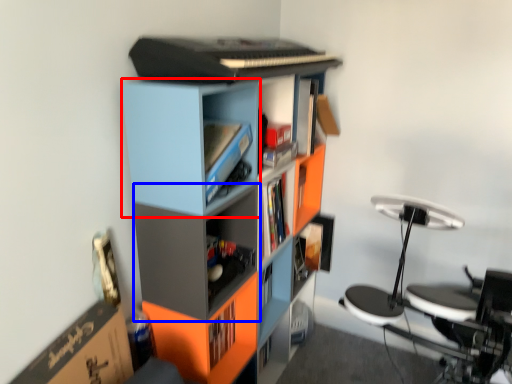
Question: Which of the following is the farthest to the observer, cabinet (highlighted by a red box) or shelf (highlighted by a blue box)?

Choices:
 (A) cabinet
 (B) shelf

Answer: (B)